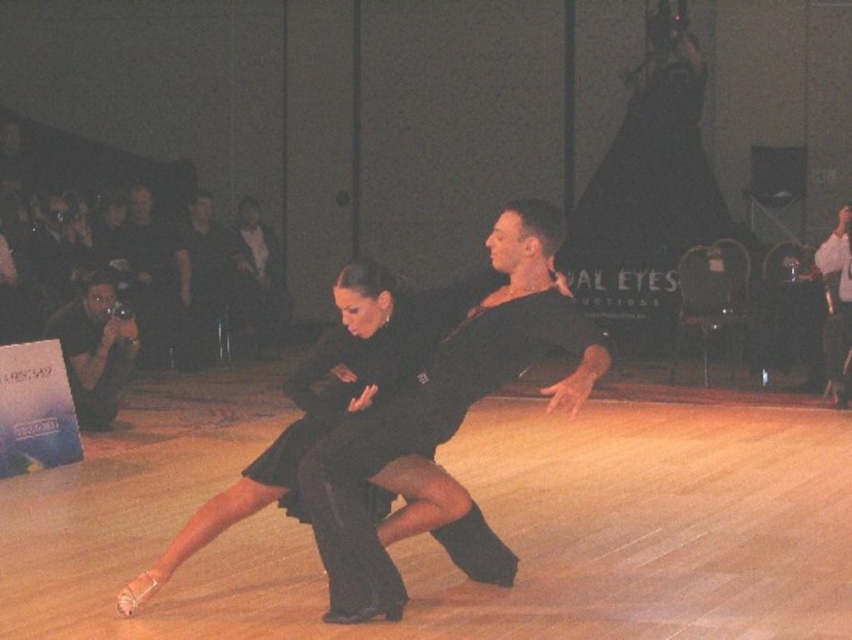
In the scene shown: You are a photographer at the dance performance and want to capture the black satin dress at center and the matte black camera at left in the same frame. Which object should you position closer to the camera to ensure both are in focus?

To ensure both the black satin dress at center and the matte black camera at left are in focus, you should position the matte black camera at left closer to the camera since it is farther away from the camera compared to the black satin dress at center.

You are a photographer positioned at the matte black camera at left. You want to capture a closeup shot of the black satin dress at center. Given that your camera has a maximum focus range of 15 feet, will you be able to focus on the dress?

The black satin dress at center is 16.94 feet away from the matte black camera at left. Since the camera has a maximum focus range of 15 feet, it cannot focus on the dress as it is beyond the range.